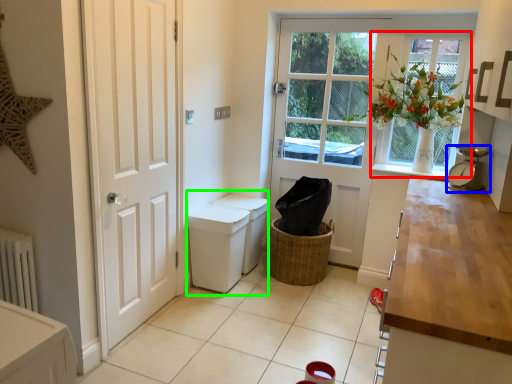
Question: Estimate the real-world distances between objects in this image. Which object is closer to window (highlighted by a red box), alarm clock (highlighted by a blue box) or sink (highlighted by a green box)?

Choices:
 (A) alarm clock
 (B) sink

Answer: (A)